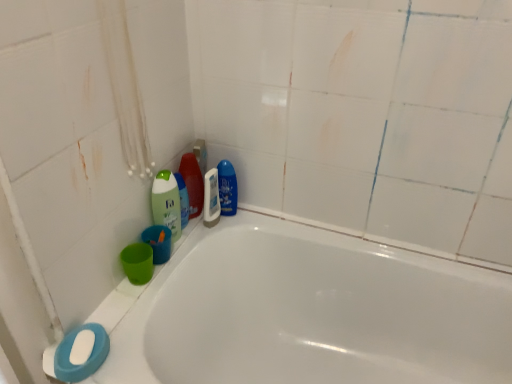
Question: Is there a large distance between white glossy bathtub at lower left and green matte bottle at upper left, the 2th cleaning product when ordered from left to right?

Choices:
 (A) no
 (B) yes

Answer: (A)

Question: Is white glossy bathtub at lower left not within green matte bottle at upper left, the third cleaning product viewed from the right?

Choices:
 (A) yes
 (B) no

Answer: (A)

Question: Are white glossy bathtub at lower left and green matte bottle at upper left, the 2th cleaning product when ordered from left to right, making contact?

Choices:
 (A) no
 (B) yes

Answer: (A)

Question: Is white glossy bathtub at lower left wider than green matte bottle at upper left, the third cleaning product viewed from the right?

Choices:
 (A) no
 (B) yes

Answer: (B)

Question: Is white glossy bathtub at lower left turned away from green matte bottle at upper left, the 2th cleaning product when ordered from left to right?

Choices:
 (A) yes
 (B) no

Answer: (B)

Question: From the image's perspective, is green matte bottle at upper left, the 2th cleaning product when ordered from left to right, located above or below green matte bottle at upper left, arranged as the fourth cleaning product when viewed from the right?

Choices:
 (A) below
 (B) above

Answer: (B)

Question: In the image, is green matte bottle at upper left, the 2th cleaning product when ordered from left to right, on the left side or the right side of green matte bottle at upper left, arranged as the fourth cleaning product when viewed from the right?

Choices:
 (A) right
 (B) left

Answer: (A)

Question: Relative to green matte bottle at upper left, arranged as the fourth cleaning product when viewed from the right, is green matte bottle at upper left, the 2th cleaning product when ordered from left to right, in front or behind?

Choices:
 (A) behind
 (B) front

Answer: (A)

Question: Which is correct: green matte bottle at upper left, the third cleaning product viewed from the right, is inside green matte bottle at upper left, arranged as the fourth cleaning product when viewed from the right, or outside of it?

Choices:
 (A) outside
 (B) inside

Answer: (A)

Question: Relative to blue glossy bottle at upper center, which appears as the fourth cleaning product when viewed from the left, is white matte soap at lower left in front or behind?

Choices:
 (A) behind
 (B) front

Answer: (B)

Question: Looking at their shapes, would you say white matte soap at lower left is wider or thinner than blue glossy bottle at upper center, which appears as the fourth cleaning product when viewed from the left?

Choices:
 (A) thin
 (B) wide

Answer: (A)

Question: From the image's perspective, is white matte soap at lower left positioned above or below blue glossy bottle at upper center, the 1th cleaning product from the right?

Choices:
 (A) above
 (B) below

Answer: (B)

Question: Which is correct: white matte soap at lower left is inside blue glossy bottle at upper center, the 1th cleaning product from the right, or outside of it?

Choices:
 (A) outside
 (B) inside

Answer: (A)

Question: Considering the positions of blue glossy bottle at upper center, which appears as the fourth cleaning product when viewed from the left, and green matte bottle at upper left, arranged as the fourth cleaning product when viewed from the right, in the image, is blue glossy bottle at upper center, which appears as the fourth cleaning product when viewed from the left, bigger or smaller than green matte bottle at upper left, arranged as the fourth cleaning product when viewed from the right,?

Choices:
 (A) big
 (B) small

Answer: (B)

Question: Is blue glossy bottle at upper center, the 1th cleaning product from the right, situated inside green matte bottle at upper left, arranged as the fourth cleaning product when viewed from the right, or outside?

Choices:
 (A) outside
 (B) inside

Answer: (A)